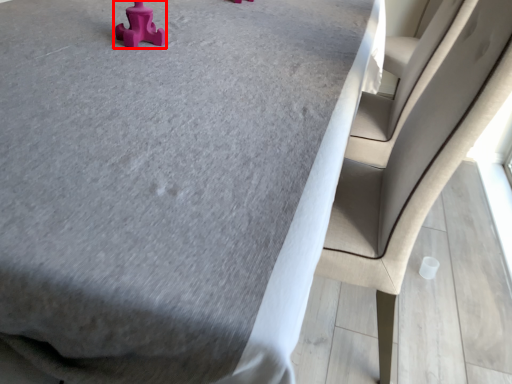
Question: From the image's perspective, where is toy (annotated by the red box) located in relation to chair in the image?

Choices:
 (A) above
 (B) below

Answer: (A)